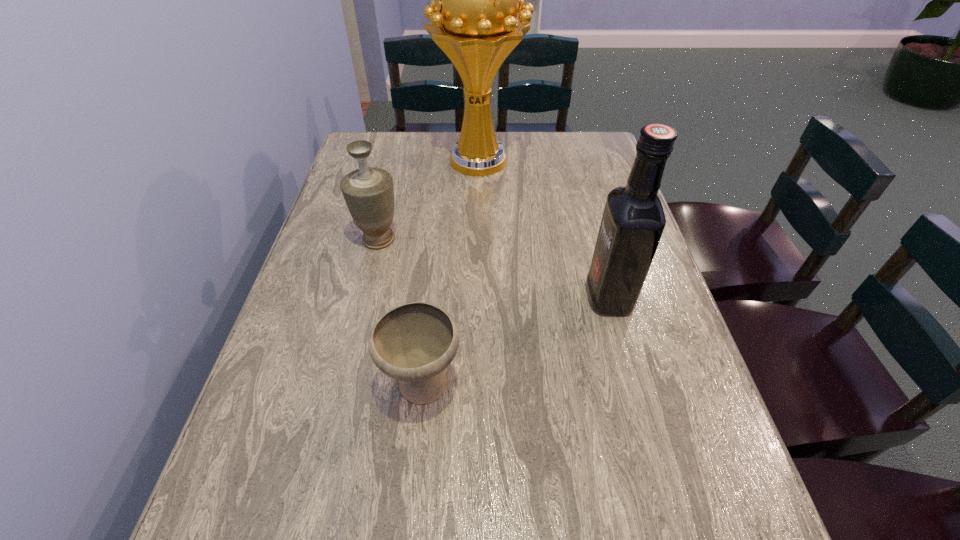
The height and width of the screenshot is (540, 960). In order to click on trophy_cup in this screenshot , I will do `click(475, 0)`.

Locate an element on the screen. This screenshot has width=960, height=540. the farthest object is located at coordinates (475, 0).

Image resolution: width=960 pixels, height=540 pixels. Find the location of `liquor`. liquor is located at coordinates (633, 220).

Locate an element on the screen. the third farthest object is located at coordinates (633, 220).

You are a GUI agent. You are given a task and a screenshot of the screen. Output one action in this format:
    pyautogui.click(x=<x>, y=<y>)
    Task: Click on the third nearest object
    Image resolution: width=960 pixels, height=540 pixels.
    Given the screenshot: What is the action you would take?
    click(368, 192)

At what (x,y) coordinates should I click in order to perform the action: click on the second shortest object. Please return your answer as a coordinate pair (x, y). The image size is (960, 540). Looking at the image, I should click on (368, 192).

This screenshot has width=960, height=540. In order to click on chalice in this screenshot , I will do `click(414, 343)`.

Identify the location of the nearest object. (414, 343).

I want to click on free spot located at the front of the trophy_cup where the globe is prominent, so click(x=478, y=252).

Identify the location of free space located 0.260m on the front-facing side of the liquor. The height and width of the screenshot is (540, 960). (471, 296).